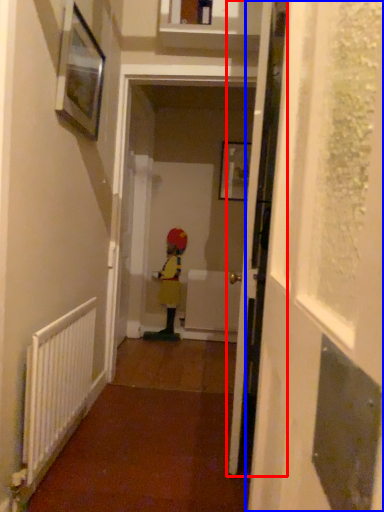
Question: Which object is further to the camera taking this photo, door (highlighted by a red box) or screen door (highlighted by a blue box)?

Choices:
 (A) door
 (B) screen door

Answer: (A)